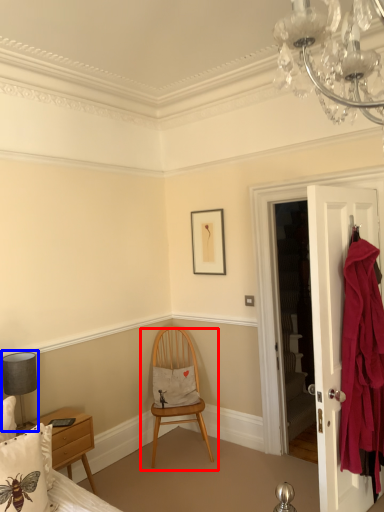
Question: Which object appears closest to the camera in this image, chair (highlighted by a red box) or lamp (highlighted by a blue box)?

Choices:
 (A) chair
 (B) lamp

Answer: (B)